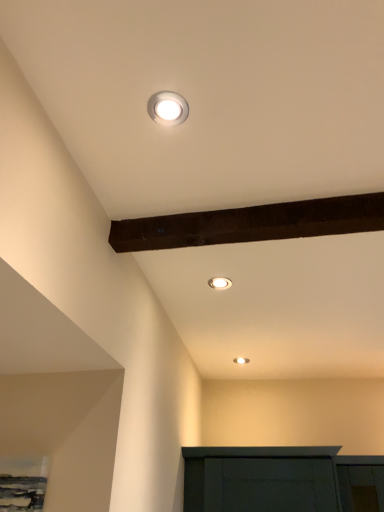
The image size is (384, 512). What do you see at coordinates (168, 108) in the screenshot?
I see `white glossy light fixture at upper center, which is the first lamp in top-to-bottom order` at bounding box center [168, 108].

Image resolution: width=384 pixels, height=512 pixels. Find the location of `matte white recessed light at center, the 2th lamp viewed from the right`. matte white recessed light at center, the 2th lamp viewed from the right is located at coordinates (220, 283).

Where is `white glossy light fixture at upper center, arranged as the first lamp when viewed from the front`? white glossy light fixture at upper center, arranged as the first lamp when viewed from the front is located at coordinates (168, 108).

Are white glossy light fixture at upper center, the 3th lamp from the front, and white glossy light fixture at upper center, marked as the third lamp in a back-to-front arrangement, located far from each other?

Yes, white glossy light fixture at upper center, the 3th lamp from the front, and white glossy light fixture at upper center, marked as the third lamp in a back-to-front arrangement, are quite far apart.

Locate an element on the screen. This screenshot has height=512, width=384. the 2nd lamp below when counting from the white glossy light fixture at upper center, which is the first lamp in top-to-bottom order (from the image's perspective) is located at coordinates (241, 360).

Considering the positions of objects white glossy light fixture at upper center, the 1th lamp viewed from the back, and white glossy light fixture at upper center, arranged as the first lamp when viewed from the front, in the image provided, who is in front, white glossy light fixture at upper center, the 1th lamp viewed from the back, or white glossy light fixture at upper center, arranged as the first lamp when viewed from the front,?

Positioned in front is white glossy light fixture at upper center, arranged as the first lamp when viewed from the front.

From the image's perspective, is white glossy light fixture at upper center, which appears as the 1th lamp when ordered from the bottom, beneath white glossy light fixture at upper center, the 3th lamp positioned from the right?

Yes, from the image's perspective, white glossy light fixture at upper center, which appears as the 1th lamp when ordered from the bottom, is beneath white glossy light fixture at upper center, the 3th lamp positioned from the right.

Considering the sizes of objects matte white recessed light at center, placed as the second lamp when sorted from front to back, and white glossy light fixture at upper center, the 3th lamp from the front, in the image provided, who is smaller, matte white recessed light at center, placed as the second lamp when sorted from front to back, or white glossy light fixture at upper center, the 3th lamp from the front,?

Smaller between the two is matte white recessed light at center, placed as the second lamp when sorted from front to back.

How different are the orientations of matte white recessed light at center, arranged as the second lamp when viewed from the top, and white glossy light fixture at upper center, which is the 3th lamp in left-to-right order, in degrees?

They differ by 0.00717 degrees in their facing directions.

Is matte white recessed light at center, the second lamp viewed from the left, located outside white glossy light fixture at upper center, the 1th lamp positioned from the right?

Yes, matte white recessed light at center, the second lamp viewed from the left, is located beyond the bounds of white glossy light fixture at upper center, the 1th lamp positioned from the right.

How far apart are matte white recessed light at center, the 2th lamp viewed from the right, and white glossy light fixture at upper center, the 1th lamp viewed from the back?

They are 37.09 inches apart.

Is the depth of white glossy light fixture at upper center, marked as the third lamp in a back-to-front arrangement, less than that of white glossy light fixture at upper center, the 1th lamp positioned from the right?

That is True.

From a real-world perspective, which is physically above, white glossy light fixture at upper center, the 3th lamp positioned from the right, or white glossy light fixture at upper center, the 1th lamp positioned from the right?

white glossy light fixture at upper center, the 1th lamp positioned from the right, from a real-world perspective.

Could you tell me if white glossy light fixture at upper center, arranged as the first lamp when viewed from the front, is turned towards white glossy light fixture at upper center, which is the 3th lamp in left-to-right order?

No, white glossy light fixture at upper center, arranged as the first lamp when viewed from the front, does not turn towards white glossy light fixture at upper center, which is the 3th lamp in left-to-right order.

Between white glossy light fixture at upper center, the third lamp viewed from the top, and matte white recessed light at center, which is the second lamp from back to front, which one has smaller width?

white glossy light fixture at upper center, the third lamp viewed from the top, is thinner.

Could you measure the distance between white glossy light fixture at upper center, which appears as the 1th lamp when ordered from the bottom, and matte white recessed light at center, the 2th lamp viewed from the right?

white glossy light fixture at upper center, which appears as the 1th lamp when ordered from the bottom, and matte white recessed light at center, the 2th lamp viewed from the right, are 37.09 inches apart.

In the scene shown: Would you consider white glossy light fixture at upper center, which is the 3th lamp in left-to-right order, to be distant from matte white recessed light at center, the second lamp viewed from the left?

white glossy light fixture at upper center, which is the 3th lamp in left-to-right order, is actually quite close to matte white recessed light at center, the second lamp viewed from the left.

Is point (244, 359) positioned behind point (216, 289)?

Yes, point (244, 359) is behind point (216, 289).

Considering the sizes of objects matte white recessed light at center, placed as the second lamp when sorted from front to back, and white glossy light fixture at upper center, the 3th lamp positioned from the right, in the image provided, who is smaller, matte white recessed light at center, placed as the second lamp when sorted from front to back, or white glossy light fixture at upper center, the 3th lamp positioned from the right,?

white glossy light fixture at upper center, the 3th lamp positioned from the right, is smaller.

From the image's perspective, which is above, matte white recessed light at center, the second lamp viewed from the left, or white glossy light fixture at upper center, acting as the first lamp starting from the left?

white glossy light fixture at upper center, acting as the first lamp starting from the left, appears higher in the image.

From a real-world perspective, count 2nd lamps downward from the matte white recessed light at center, the second lamp viewed from the left, and point to it. Please provide its 2D coordinates.

[(168, 108)]

In the scene shown: Is matte white recessed light at center, the 2th lamp viewed from the right, inside or outside of white glossy light fixture at upper center, acting as the first lamp starting from the left?

matte white recessed light at center, the 2th lamp viewed from the right, is not inside white glossy light fixture at upper center, acting as the first lamp starting from the left, it's outside.

Considering the positions of objects white glossy light fixture at upper center, placed as the third lamp when sorted from bottom to top, and matte white recessed light at center, which ranks as the 2th lamp in bottom-to-top order, in the image provided, who is in front, white glossy light fixture at upper center, placed as the third lamp when sorted from bottom to top, or matte white recessed light at center, which ranks as the 2th lamp in bottom-to-top order,?

Positioned in front is white glossy light fixture at upper center, placed as the third lamp when sorted from bottom to top.

In the scene shown: Is white glossy light fixture at upper center, marked as the third lamp in a back-to-front arrangement, smaller than matte white recessed light at center, which is the second lamp from back to front?

Yes.

Is white glossy light fixture at upper center, placed as the third lamp when sorted from bottom to top, shorter than matte white recessed light at center, which ranks as the 2th lamp in bottom-to-top order?

Yes, white glossy light fixture at upper center, placed as the third lamp when sorted from bottom to top, is shorter than matte white recessed light at center, which ranks as the 2th lamp in bottom-to-top order.

Where is `lamp that is the 2nd object located above the white glossy light fixture at upper center, which is the 3th lamp in left-to-right order (from the image's perspective)`? The height and width of the screenshot is (512, 384). lamp that is the 2nd object located above the white glossy light fixture at upper center, which is the 3th lamp in left-to-right order (from the image's perspective) is located at coordinates (168, 108).

Locate an element on the screen. This screenshot has width=384, height=512. lamp that appears on the right of matte white recessed light at center, the 2th lamp viewed from the right is located at coordinates (241, 360).

Looking at the image, which one is located closer to matte white recessed light at center, which ranks as the 2th lamp in bottom-to-top order, white glossy light fixture at upper center, arranged as the first lamp when viewed from the front, or white glossy light fixture at upper center, the third lamp viewed from the top?

Among the two, white glossy light fixture at upper center, arranged as the first lamp when viewed from the front, is located nearer to matte white recessed light at center, which ranks as the 2th lamp in bottom-to-top order.

From the picture: Considering their positions, is white glossy light fixture at upper center, the 1th lamp viewed from the back, positioned further to matte white recessed light at center, which ranks as the 2th lamp in bottom-to-top order, than white glossy light fixture at upper center, acting as the first lamp starting from the left?

white glossy light fixture at upper center, the 1th lamp viewed from the back.

Based on their spatial positions, is matte white recessed light at center, arranged as the second lamp when viewed from the top, or white glossy light fixture at upper center, marked as the third lamp in a back-to-front arrangement, further from white glossy light fixture at upper center, which appears as the 1th lamp when ordered from the bottom?

white glossy light fixture at upper center, marked as the third lamp in a back-to-front arrangement, is further to white glossy light fixture at upper center, which appears as the 1th lamp when ordered from the bottom.

Looking at the image, which one is located further to white glossy light fixture at upper center, placed as the third lamp when sorted from bottom to top, white glossy light fixture at upper center, the 1th lamp positioned from the right, or matte white recessed light at center, which is the second lamp from back to front?

white glossy light fixture at upper center, the 1th lamp positioned from the right, is further to white glossy light fixture at upper center, placed as the third lamp when sorted from bottom to top.

Which object lies nearer to the anchor point white glossy light fixture at upper center, the 1th lamp positioned from the right, white glossy light fixture at upper center, arranged as the first lamp when viewed from the front, or matte white recessed light at center, placed as the second lamp when sorted from front to back?

matte white recessed light at center, placed as the second lamp when sorted from front to back, is closer to white glossy light fixture at upper center, the 1th lamp positioned from the right.

From the image, which object appears to be nearer to white glossy light fixture at upper center, which is the first lamp in top-to-bottom order, matte white recessed light at center, arranged as the second lamp when viewed from the top, or white glossy light fixture at upper center, which is the 3th lamp in left-to-right order?

matte white recessed light at center, arranged as the second lamp when viewed from the top, is closer to white glossy light fixture at upper center, which is the first lamp in top-to-bottom order.

At what (x,y) coordinates should I click in order to perform the action: click on lamp between white glossy light fixture at upper center, the 3th lamp positioned from the right, and white glossy light fixture at upper center, the 1th lamp viewed from the back, along the z-axis. Please return your answer as a coordinate pair (x, y). The width and height of the screenshot is (384, 512). Looking at the image, I should click on (220, 283).